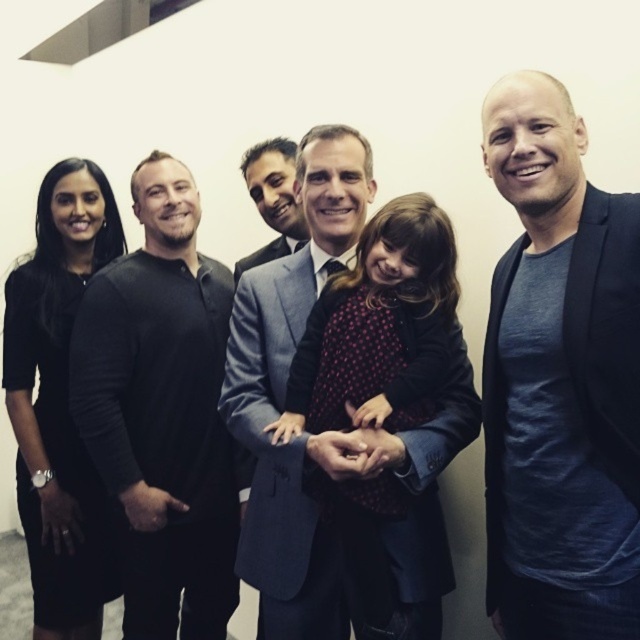
Is point (557, 413) in front of point (356, 374)?

That is True.

Is the position of dark blue t-shirt at center more distant than that of polka dot fabric dress at center?

That is False.

The image size is (640, 640). What do you see at coordinates (560, 380) in the screenshot?
I see `dark blue t-shirt at center` at bounding box center [560, 380].

Where is `dark blue t-shirt at center`? dark blue t-shirt at center is located at coordinates (560, 380).

From the picture: Measure the distance between polka dot fabric dress at center and gray suit at center.

polka dot fabric dress at center and gray suit at center are 32.72 inches apart from each other.

Who is more forward, (323, 358) or (292, 237)?

Positioned in front is point (323, 358).

Is point (429, 506) farther from viewer compared to point (273, 198)?

No, it is not.

This screenshot has width=640, height=640. I want to click on polka dot fabric dress at center, so click(x=380, y=330).

Describe the element at coordinates (163, 412) in the screenshot. This screenshot has height=640, width=640. I see `black matte shirt at left` at that location.

Which is below, black matte shirt at left or dark gray suit at center?

Positioned lower is black matte shirt at left.

This screenshot has width=640, height=640. I want to click on black matte shirt at left, so click(163, 412).